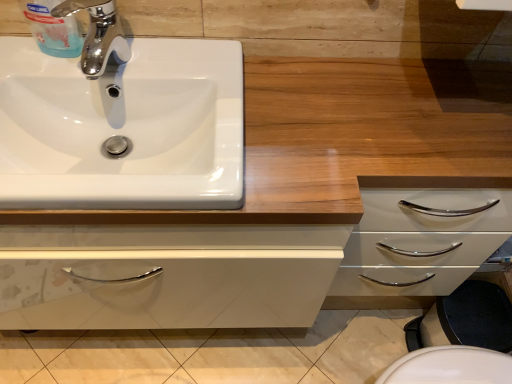
Question: From the image's perspective, is chrome/metallic faucet at upper left above or below wooden counter at upper center?

Choices:
 (A) below
 (B) above

Answer: (B)

Question: Would you say chrome/metallic faucet at upper left is to the left or to the right of wooden counter at upper center in the picture?

Choices:
 (A) right
 (B) left

Answer: (B)

Question: Which object is positioned closest to the chrome/metallic faucet at upper left?

Choices:
 (A) white glossy sink at upper left
 (B) wooden counter at upper center

Answer: (A)

Question: Which object is the farthest from the chrome/metallic faucet at upper left?

Choices:
 (A) white glossy sink at upper left
 (B) wooden counter at upper center

Answer: (B)